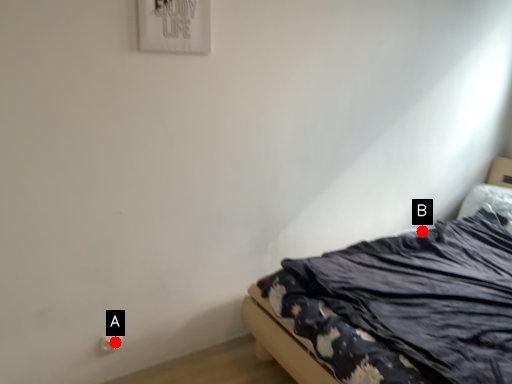
Question: Two points are circled on the image, labeled by A and B beside each circle. Which point is farther from the camera taking this photo?

Choices:
 (A) A is further
 (B) B is further

Answer: (B)